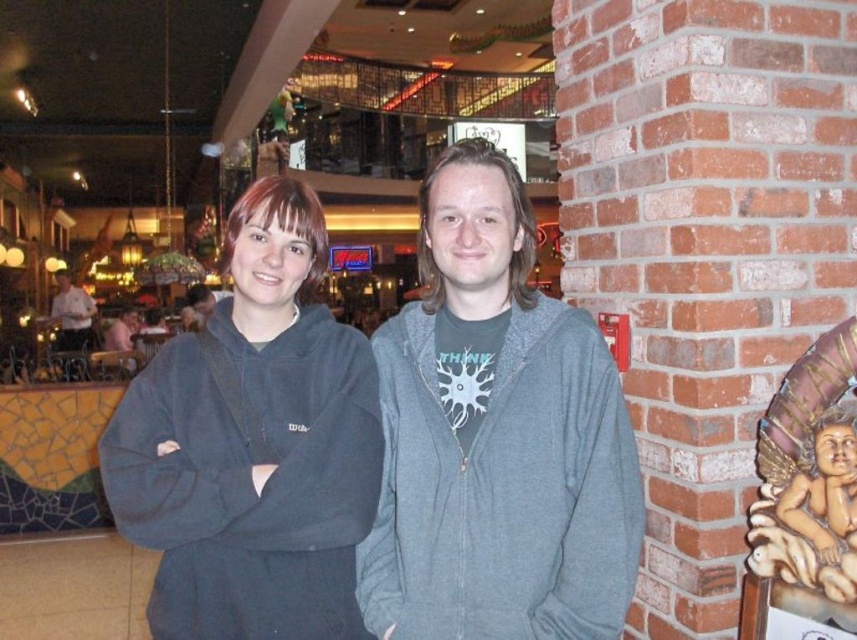
Is dark gray fleece at center positioned before gray fleece sweatshirt at center?

No, it is behind gray fleece sweatshirt at center.

Does dark gray fleece at center have a larger size compared to gray fleece sweatshirt at center?

Yes, dark gray fleece at center is bigger than gray fleece sweatshirt at center.

Is point (274, 252) farther from viewer compared to point (438, 376)?

Yes, it is.

This screenshot has height=640, width=857. In order to click on dark gray fleece at center in this screenshot , I will do `click(253, 444)`.

Is gray fleece sweatshirt at center smaller than white shirt at left?

Yes.

Can you confirm if gray fleece sweatshirt at center is taller than white shirt at left?

Yes, gray fleece sweatshirt at center is taller than white shirt at left.

Between point (566, 509) and point (93, 332), which one is positioned behind?

The point (93, 332) is more distant.

Image resolution: width=857 pixels, height=640 pixels. Identify the location of gray fleece sweatshirt at center. (502, 488).

Based on the photo, can you confirm if dark gray sweatshirt at center is wider than white shirt at left?

Yes.

Based on the photo, can you confirm if dark gray sweatshirt at center is taller than white shirt at left?

Indeed, dark gray sweatshirt at center has a greater height compared to white shirt at left.

At what (x,y) coordinates should I click in order to perform the action: click on dark gray sweatshirt at center. Please return your answer as a coordinate pair (x, y). Looking at the image, I should click on (496, 436).

Image resolution: width=857 pixels, height=640 pixels. I want to click on dark gray sweatshirt at center, so click(x=496, y=436).